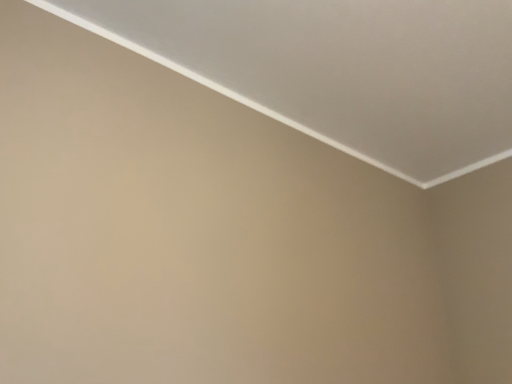
The width and height of the screenshot is (512, 384). What do you see at coordinates (341, 69) in the screenshot?
I see `white glossy exhaust hood at upper center` at bounding box center [341, 69].

You are a GUI agent. You are given a task and a screenshot of the screen. Output one action in this format:
    pyautogui.click(x=<x>, y=<y>)
    Task: Click on the white glossy exhaust hood at upper center
    
    Given the screenshot: What is the action you would take?
    pyautogui.click(x=341, y=69)

You are a GUI agent. You are given a task and a screenshot of the screen. Output one action in this format:
    pyautogui.click(x=<x>, y=<y>)
    Task: Click on the white glossy exhaust hood at upper center
    
    Given the screenshot: What is the action you would take?
    pyautogui.click(x=341, y=69)